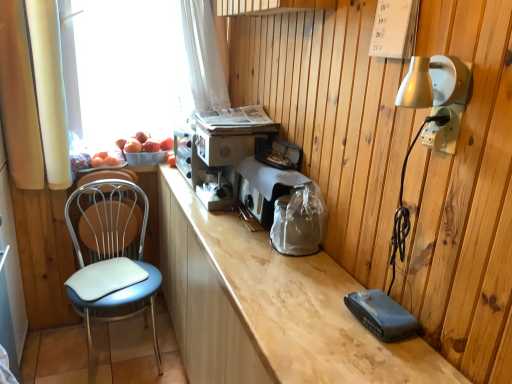
Question: Is white plastic electrical outlet at upper right shorter than white fabric curtain at left?

Choices:
 (A) no
 (B) yes

Answer: (B)

Question: Is white plastic electrical outlet at upper right not inside white fabric curtain at left?

Choices:
 (A) no
 (B) yes

Answer: (B)

Question: From a real-world perspective, is white plastic electrical outlet at upper right physically above white fabric curtain at left?

Choices:
 (A) no
 (B) yes

Answer: (B)

Question: From a real-world perspective, is white plastic electrical outlet at upper right beneath white fabric curtain at left?

Choices:
 (A) no
 (B) yes

Answer: (A)

Question: Is white plastic electrical outlet at upper right taller than white fabric curtain at left?

Choices:
 (A) no
 (B) yes

Answer: (A)

Question: In terms of size, does metallic silver coffee machine at center appear bigger or smaller than transparent plastic basket at upper left?

Choices:
 (A) small
 (B) big

Answer: (A)

Question: From a real-world perspective, relative to transparent plastic basket at upper left, is metallic silver coffee machine at center vertically above or below?

Choices:
 (A) below
 (B) above

Answer: (A)

Question: Is point coord(190,165) positioned closer to the camera than point coord(180,54)?

Choices:
 (A) farther
 (B) closer

Answer: (B)

Question: Considering the positions of metallic silver coffee machine at center and transparent plastic basket at upper left in the image, is metallic silver coffee machine at center wider or thinner than transparent plastic basket at upper left?

Choices:
 (A) wide
 (B) thin

Answer: (A)

Question: Based on their positions, is white fabric curtain at left located to the left or right of metallic silver coffee machine at center?

Choices:
 (A) right
 (B) left

Answer: (B)

Question: From their relative heights in the image, would you say white fabric curtain at left is taller or shorter than metallic silver coffee machine at center?

Choices:
 (A) short
 (B) tall

Answer: (B)

Question: Does point (51, 16) appear closer or farther from the camera than point (233, 114)?

Choices:
 (A) farther
 (B) closer

Answer: (B)

Question: Is white fabric curtain at left inside the boundaries of metallic silver coffee machine at center, or outside?

Choices:
 (A) outside
 (B) inside

Answer: (A)

Question: Considering the positions of white plastic electrical outlet at upper right and transparent plastic basket at upper left in the image, is white plastic electrical outlet at upper right bigger or smaller than transparent plastic basket at upper left?

Choices:
 (A) small
 (B) big

Answer: (A)

Question: Relative to transparent plastic basket at upper left, is white plastic electrical outlet at upper right in front or behind?

Choices:
 (A) front
 (B) behind

Answer: (A)